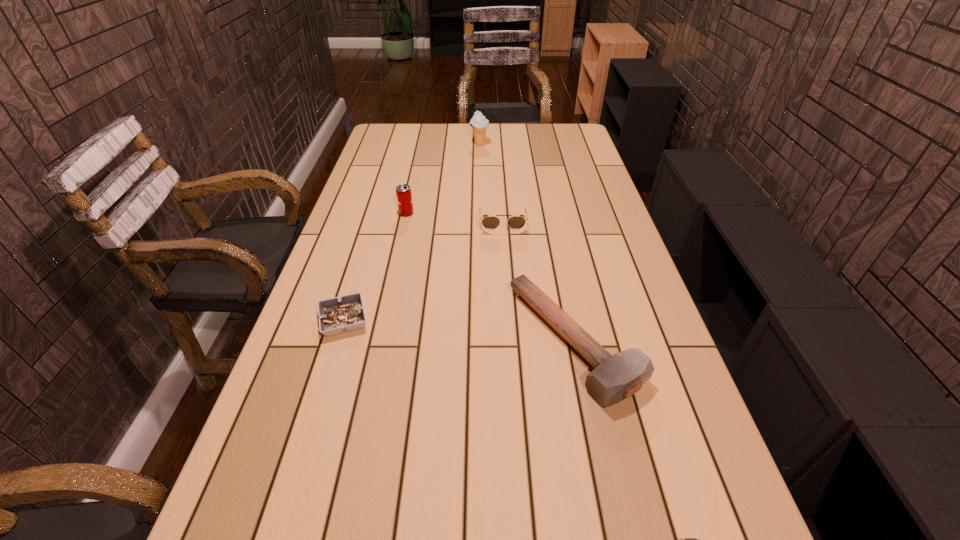
The height and width of the screenshot is (540, 960). I want to click on free space between the sunglasses and the beer can, so click(454, 218).

The image size is (960, 540). In order to click on vacant space that's between the beer can and the farther ashtray in this screenshot , I will do `click(375, 267)`.

Find the location of a particular element. free space that is in between the beer can and the mallet is located at coordinates (491, 277).

Where is `blank region between the sunglasses and the left ashtray`? blank region between the sunglasses and the left ashtray is located at coordinates (423, 272).

Find the location of a particular element. The width and height of the screenshot is (960, 540). unoccupied position between the leftmost object and the sunglasses is located at coordinates (423, 272).

I want to click on free space between the beer can and the farthest object, so click(443, 179).

Locate which object ranks fourth in proximity to the fifth object from right to left. Please provide its 2D coordinates. Your answer should be formatted as a tuple, i.e. [(x, y)], where the tuple contains the x and y coordinates of a point satisfying the conditions above.

[(479, 123)]

Locate an element on the screen. object that is the second closest one to the leftmost object is located at coordinates (403, 191).

Find the location of a particular element. free space that satisfies the following two spatial constraints: 1. on the back side of the leftmost object; 2. on the right side of the farthest object is located at coordinates (398, 145).